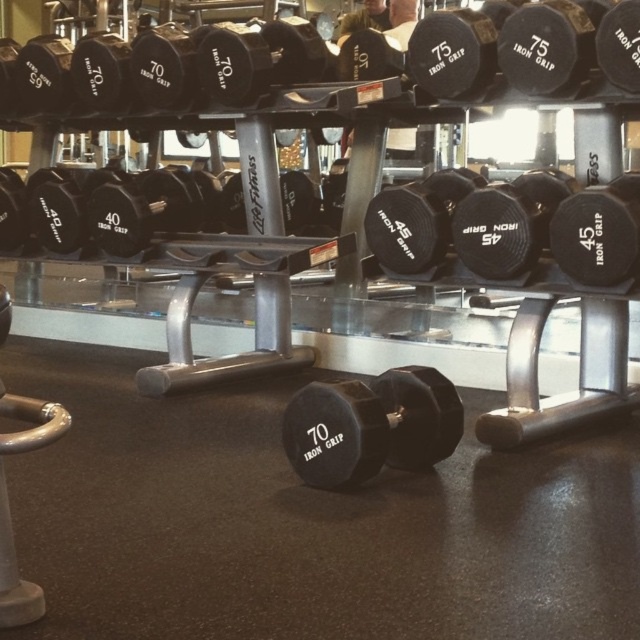
You are a gym trainer standing at the front of the room and want to hand out the black rubber dumbbells at upper center to a client who is 1.7 meters tall. Can the client reach the dumbbells without assistance?

The black rubber dumbbells at upper center are 1.86 meters away from the viewer. Since the client is 1.7 meters tall, they would need assistance to reach the dumbbells as the distance exceeds their height.

You are a gym trainer helping a client choose weights. The client wants to start with the lighter dumbbell first before moving to the heavier one. Which dumbbell should they pick first, the black rubber dumbbells at upper center or the black rubber dumbbell at center?

The black rubber dumbbell at center should be picked first because the black rubber dumbbells at upper center has a larger size, indicating it is heavier.

You are a gym trainer who needs to move a 4x4x4 wooden box that measures 4 feet in width between the black rubber dumbbells at upper center and the black rubber dumbbell at center. Can the box fit between them without tilting?

The distance between the black rubber dumbbells at upper center and the black rubber dumbbell at center is 3.96 feet. Since the box is 4 feet wide, it cannot fit between them as the space is slightly narrower than the box.